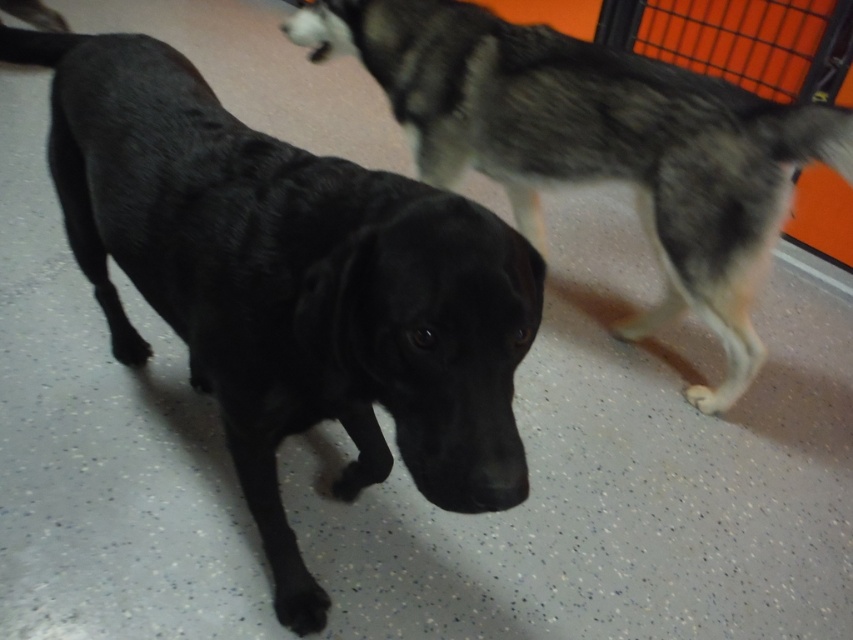
You are a dog trainer who needs to place a 36 inch wide barrier between the two dogs to keep them separated. Based on the scene, will the barrier fit between the black matte dog at center and the black fur dog at center?

The black matte dog at center and the black fur dog at center are 37.39 inches apart from each other. Since the barrier is 36 inches wide, it will fit between them as the distance between them is greater than the barrier width.